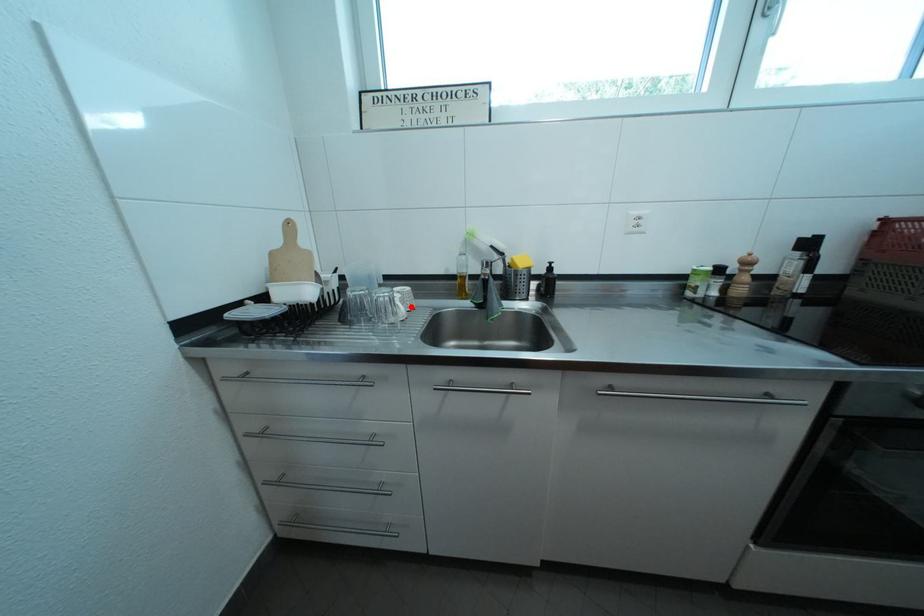
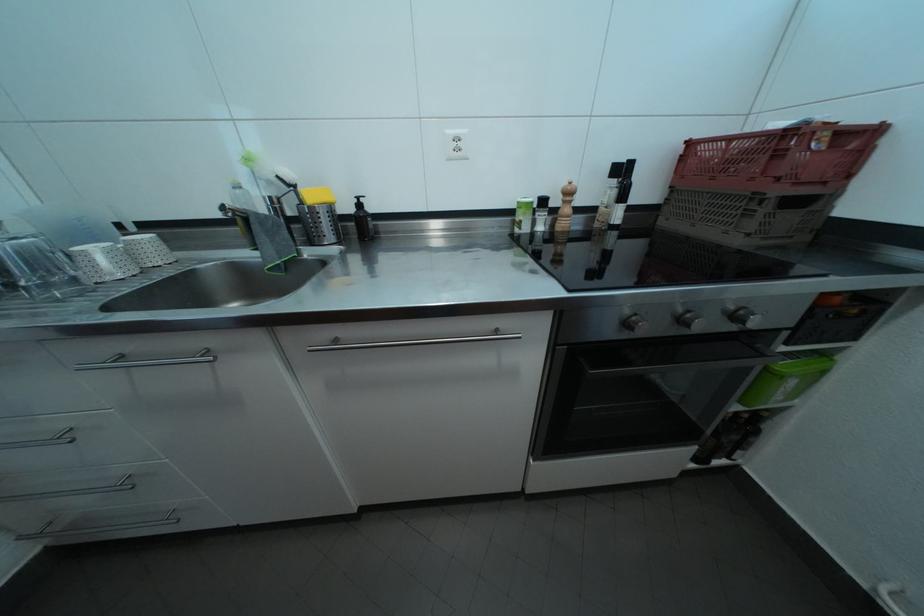
Find the pixel in the second image that matches the highlighted location in the first image.

(137, 259)